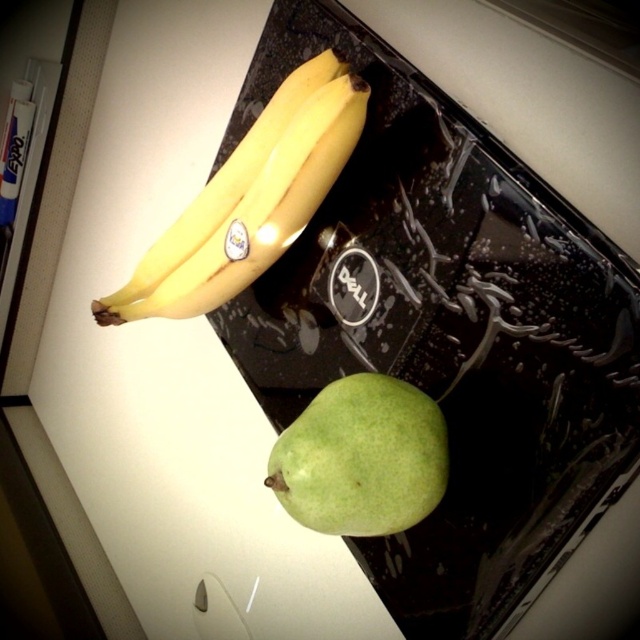
You are packing a lunchbox and need to decide which fruit to place first. Since the yellow matte banana at upper left and the green matte pear at lower center are on a small tray, which fruit should you pick first to ensure both fit properly?

The yellow matte banana at upper left is bigger than the green matte pear at lower center, so you should pick the yellow matte banana at upper left first to ensure there is enough space left for the smaller green matte pear at lower center.

Please provide the 2D coordinates of the yellow matte banana at upper left from the image description provided.

The yellow matte banana at upper left is located at coordinates (250, 198).

You are arranging fruits on a tray for a fruit platter. You need to place a yellow matte banana at upper left and a green matte pear at lower center. According to the image, where should you position the banana relative to the pear?

The yellow matte banana at upper left should be placed to the left of the green matte pear at lower center, as per the image.